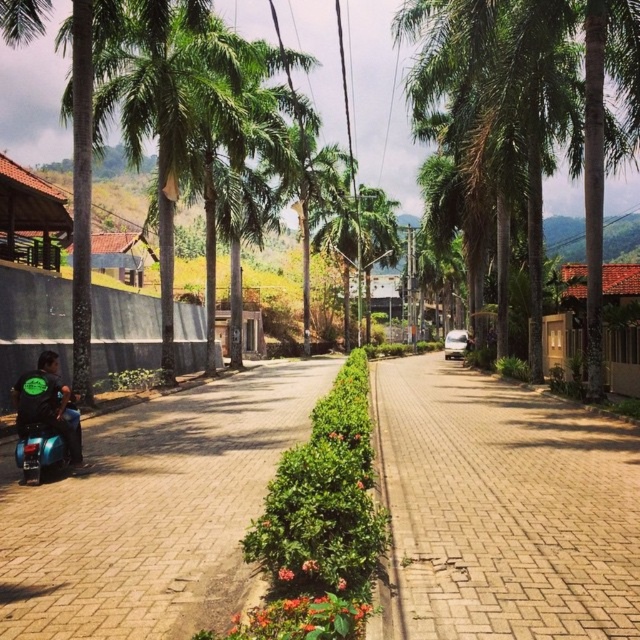
Question: Which of the following is the farthest from the observer?

Choices:
 (A) dark green fabric motorcyclist at lower left
 (B) blue glossy scooter at lower left
 (C) brick paved road at center

Answer: (A)

Question: Among these objects, which one is nearest to the camera?

Choices:
 (A) blue glossy scooter at lower left
 (B) dark green fabric motorcyclist at lower left
 (C) brick paved road at center

Answer: (A)

Question: Which point is farther to the camera?

Choices:
 (A) (600, 490)
 (B) (20, 468)
 (C) (237, 458)

Answer: (C)

Question: Is brick paved road at center to the right of blue glossy scooter at lower left from the viewer's perspective?

Choices:
 (A) yes
 (B) no

Answer: (A)

Question: From the image, what is the correct spatial relationship of brick paved road at center in relation to blue glossy scooter at lower left?

Choices:
 (A) right
 (B) left

Answer: (A)

Question: Considering the relative positions of brick paved road at center and dark green fabric motorcyclist at lower left in the image provided, where is brick paved road at center located with respect to dark green fabric motorcyclist at lower left?

Choices:
 (A) left
 (B) right

Answer: (B)